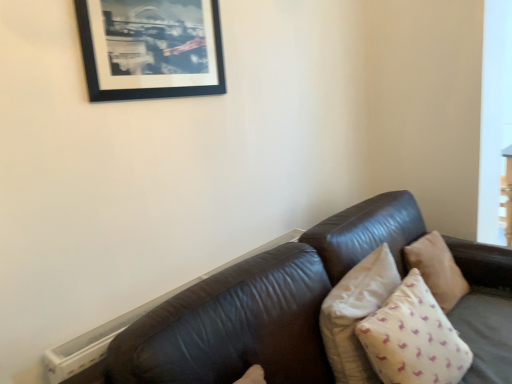
Question: Is beige fabric pillow at right, the 2th pillow from the front, facing away from black matte picture frame at upper left?

Choices:
 (A) yes
 (B) no

Answer: (B)

Question: From a real-world perspective, is beige fabric pillow at right, arranged as the 2th pillow when viewed from the back, physically above black matte picture frame at upper left?

Choices:
 (A) yes
 (B) no

Answer: (B)

Question: Could you tell me if beige fabric pillow at right, the 2th pillow from the front, is facing black matte picture frame at upper left?

Choices:
 (A) yes
 (B) no

Answer: (B)

Question: Does beige fabric pillow at right, arranged as the 2th pillow when viewed from the back, have a smaller size compared to black matte picture frame at upper left?

Choices:
 (A) yes
 (B) no

Answer: (B)

Question: Is beige fabric pillow at right, the 2th pillow from the front, positioned behind black matte picture frame at upper left?

Choices:
 (A) yes
 (B) no

Answer: (A)

Question: Is beige fabric pillow at right, arranged as the 2th pillow when viewed from the back, outside of black matte picture frame at upper left?

Choices:
 (A) no
 (B) yes

Answer: (B)

Question: Is beige fabric pillow at right, arranged as the 2th pillow when viewed from the back, smaller than beige fabric pillow at right, which is the 3th pillow in front-to-back order?

Choices:
 (A) no
 (B) yes

Answer: (A)

Question: From the image's perspective, would you say beige fabric pillow at right, arranged as the 2th pillow when viewed from the back, is positioned over beige fabric pillow at right, which is the 3th pillow in front-to-back order?

Choices:
 (A) yes
 (B) no

Answer: (B)

Question: Is beige fabric pillow at right, the 2th pillow from the front, not inside beige fabric pillow at right, which is the 3th pillow in front-to-back order?

Choices:
 (A) no
 (B) yes

Answer: (B)

Question: Is beige fabric pillow at right, which is the 3th pillow in front-to-back order, at the back of beige fabric pillow at right, the 2th pillow from the front?

Choices:
 (A) yes
 (B) no

Answer: (B)

Question: Is beige fabric pillow at right, arranged as the 2th pillow when viewed from the back, far away from beige fabric pillow at right, which is counted as the 1th pillow, starting from the back?

Choices:
 (A) no
 (B) yes

Answer: (A)

Question: Does beige fabric pillow at right, the 2th pillow from the front, have a larger size compared to beige fabric pillow at right, which is the 3th pillow in front-to-back order?

Choices:
 (A) yes
 (B) no

Answer: (A)

Question: Are beige cotton pillow at lower right, which is the third pillow from back to front, and beige fabric pillow at right, which is the 3th pillow in front-to-back order, located far from each other?

Choices:
 (A) no
 (B) yes

Answer: (A)